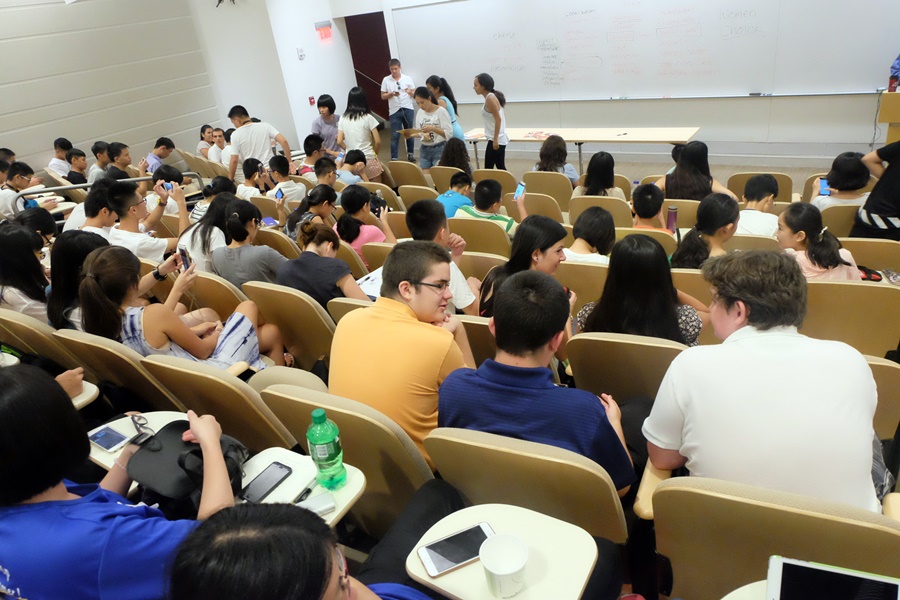
Image resolution: width=900 pixels, height=600 pixels. What are the coordinates of `exit sign` in the screenshot? It's located at (324, 34).